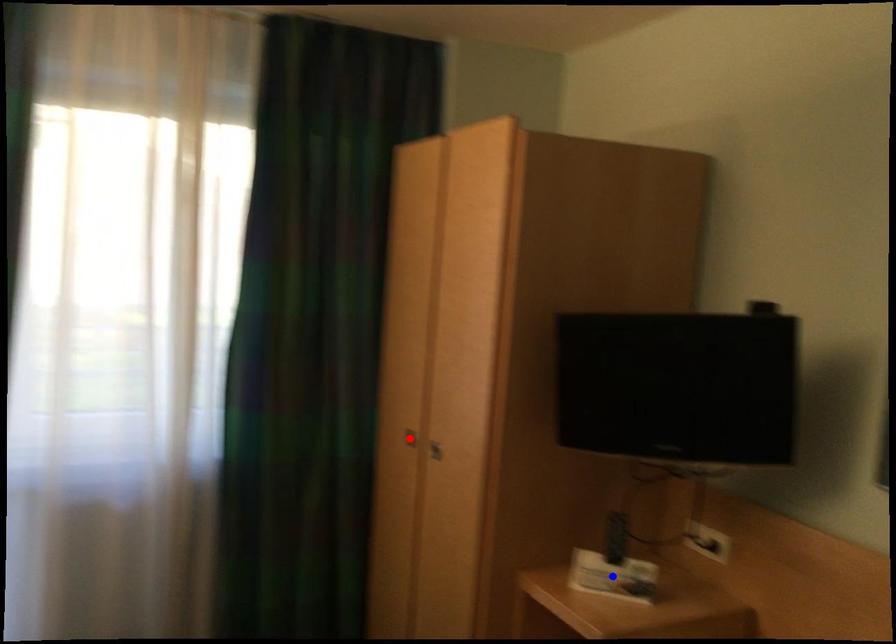
Question: In the image, two points are highlighted. Which point is nearer to the camera? Reply with the corresponding letter.

Choices:
 (A) blue point
 (B) red point

Answer: (A)